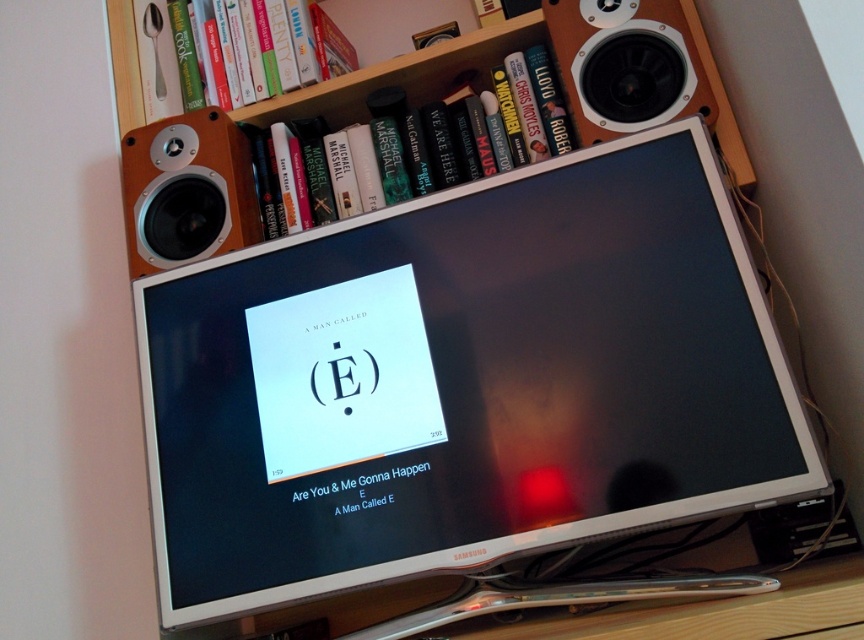
Question: Estimate the real-world distances between objects in this image. Which object is farther from the wooden bookshelf at upper center?

Choices:
 (A) satin black monitor at center
 (B) hardcover book at upper left
 (C) wooden/matte speaker at left

Answer: (A)

Question: From the image, what is the correct spatial relationship of satin black monitor at center in relation to wooden/matte speaker at left?

Choices:
 (A) left
 (B) right

Answer: (B)

Question: Which object appears closest to the camera in this image?

Choices:
 (A) wooden/matte speaker at left
 (B) wooden bookshelf at upper center

Answer: (A)

Question: Is hardcover book at upper center positioned in front of hardcover book at upper left?

Choices:
 (A) no
 (B) yes

Answer: (B)

Question: Can you confirm if satin black monitor at center is smaller than wooden speaker at upper right?

Choices:
 (A) yes
 (B) no

Answer: (B)

Question: Considering the real-world distances, which object is closest to the hardcover book at upper left?

Choices:
 (A) satin black monitor at center
 (B) wooden speaker at upper right
 (C) hardcover book at upper center
 (D) wooden/matte speaker at left

Answer: (D)